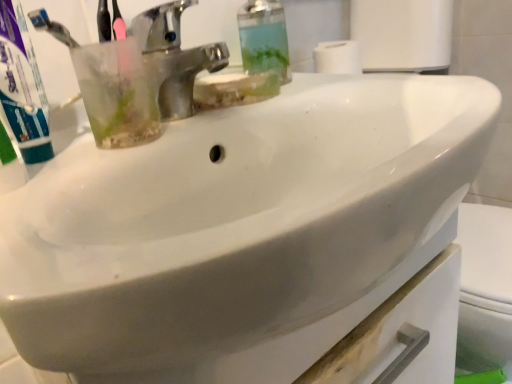
Identify the location of vacant area that is in front of transparent plastic soap dispenser at upper center. This screenshot has width=512, height=384. (293, 95).